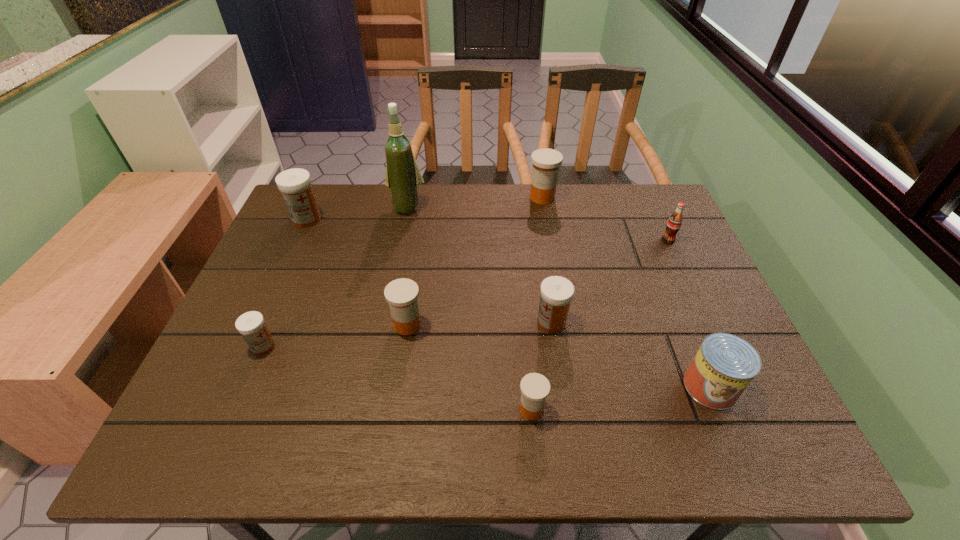
Locate an element on the screen. object that is the fourth closest to the farthest orange medicine is located at coordinates (401, 294).

Where is `object identified as the sixth closest to the biggest white medicine`? The image size is (960, 540). object identified as the sixth closest to the biggest white medicine is located at coordinates pyautogui.click(x=534, y=387).

What are the coordinates of `medicine that can be found as the second closest to the biggest orange medicine` in the screenshot? It's located at (401, 294).

Identify which medicine is located as the second nearest to the rightmost white medicine. Please provide its 2D coordinates. Your answer should be formatted as a tuple, i.e. [(x, y)], where the tuple contains the x and y coordinates of a point satisfying the conditions above.

[(401, 294)]

Point out which orange medicine is positioned as the second nearest to the nearest white medicine. Please provide its 2D coordinates. Your answer should be formatted as a tuple, i.e. [(x, y)], where the tuple contains the x and y coordinates of a point satisfying the conditions above.

[(534, 387)]

Select which orange medicine is the second closest to the rightmost white medicine. Please provide its 2D coordinates. Your answer should be formatted as a tuple, i.e. [(x, y)], where the tuple contains the x and y coordinates of a point satisfying the conditions above.

[(401, 294)]

Image resolution: width=960 pixels, height=540 pixels. I want to click on the second closest white medicine to the tallest object, so click(556, 292).

At what (x,y) coordinates should I click in order to perform the action: click on white medicine that is the closest to the biggest white medicine. Please return your answer as a coordinate pair (x, y). Looking at the image, I should click on (251, 325).

The height and width of the screenshot is (540, 960). I want to click on free space that satisfies the following two spatial constraints: 1. on the front-facing side of the can; 2. on the left side of the wine bottle, so click(372, 387).

Where is `free space that satisfies the following two spatial constraints: 1. on the front side of the second farthest white medicine; 2. on the label of the second farthest orange medicine`? free space that satisfies the following two spatial constraints: 1. on the front side of the second farthest white medicine; 2. on the label of the second farthest orange medicine is located at coordinates (552, 325).